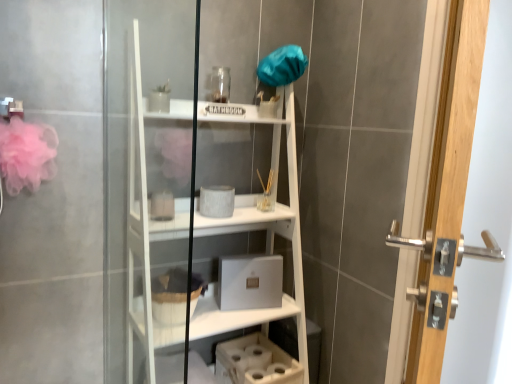
Question: Considering the relative sizes of white matte bookshelf at center and polished silver handle at right in the image provided, is white matte bookshelf at center smaller than polished silver handle at right?

Choices:
 (A) no
 (B) yes

Answer: (A)

Question: Is the depth of white matte bookshelf at center less than that of polished silver handle at right?

Choices:
 (A) no
 (B) yes

Answer: (A)

Question: From a real-world perspective, is white matte bookshelf at center on polished silver handle at right?

Choices:
 (A) no
 (B) yes

Answer: (A)

Question: Is white matte bookshelf at center in contact with polished silver handle at right?

Choices:
 (A) no
 (B) yes

Answer: (A)

Question: Would you say white matte bookshelf at center is outside polished silver handle at right?

Choices:
 (A) yes
 (B) no

Answer: (A)

Question: Is point (178, 307) closer or farther from the camera than point (440, 125)?

Choices:
 (A) closer
 (B) farther

Answer: (B)

Question: From the image's perspective, relative to polished silver handle at right, is fuzzy fabric basket at lower center above or below?

Choices:
 (A) below
 (B) above

Answer: (A)

Question: Is fuzzy fabric basket at lower center to the left or to the right of polished silver handle at right in the image?

Choices:
 (A) right
 (B) left

Answer: (B)

Question: Looking at the image, does fuzzy fabric basket at lower center seem bigger or smaller compared to polished silver handle at right?

Choices:
 (A) big
 (B) small

Answer: (B)

Question: Considering the positions of fuzzy fabric basket at lower center and white matte bookshelf at center in the image, is fuzzy fabric basket at lower center wider or thinner than white matte bookshelf at center?

Choices:
 (A) thin
 (B) wide

Answer: (A)

Question: Is point (154, 286) positioned closer to the camera than point (270, 223)?

Choices:
 (A) farther
 (B) closer

Answer: (B)

Question: Is fuzzy fabric basket at lower center inside or outside of white matte bookshelf at center?

Choices:
 (A) inside
 (B) outside

Answer: (A)

Question: From a real-world perspective, is fuzzy fabric basket at lower center above or below white matte bookshelf at center?

Choices:
 (A) above
 (B) below

Answer: (B)

Question: Is white matte bookshelf at center to the left or to the right of fuzzy fabric basket at lower center in the image?

Choices:
 (A) left
 (B) right

Answer: (B)

Question: Is white matte bookshelf at center taller or shorter than fuzzy fabric basket at lower center?

Choices:
 (A) short
 (B) tall

Answer: (B)